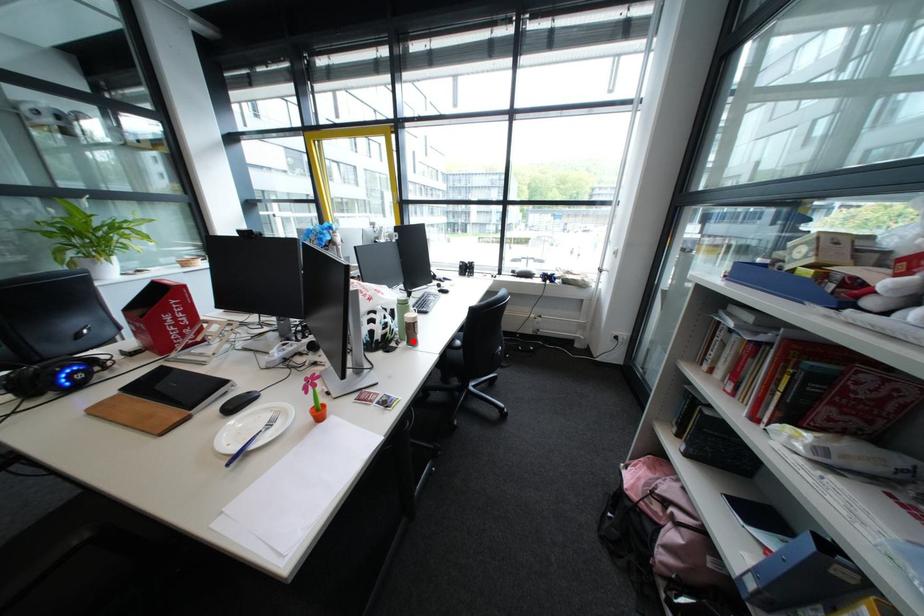
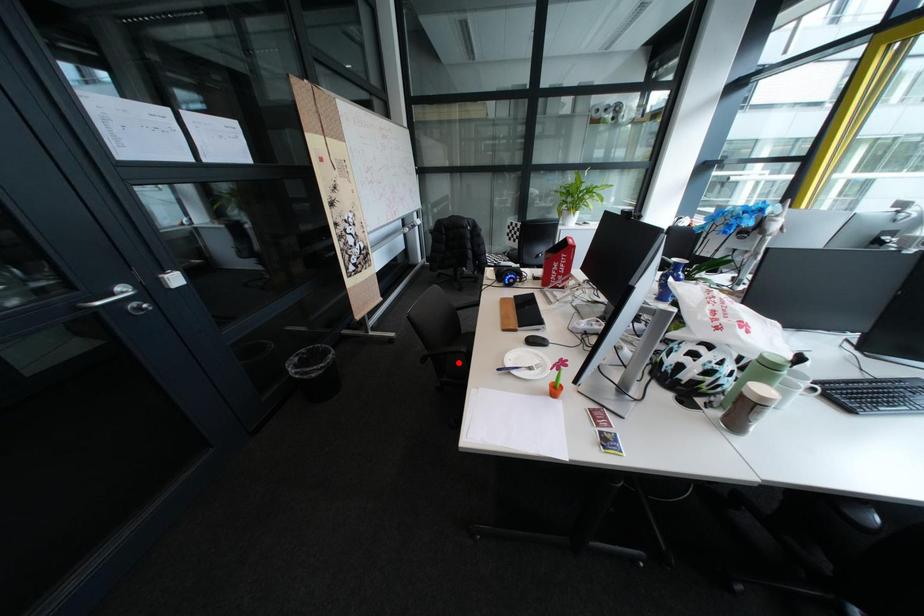
I am providing you with two images of the same scene from different viewpoints. A red point is marked on the first image and another point is marked on the second image. Are the points marked in image1 and image2 representing the same 3D position?

No